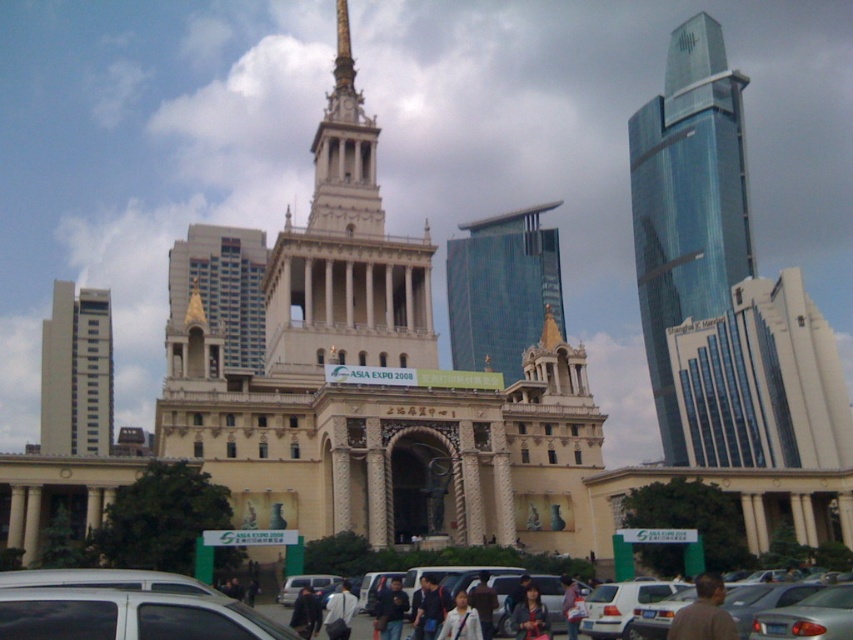
Can you confirm if shiny glass skyscraper at right is taller than light gray fabric jacket at center?

Correct, shiny glass skyscraper at right is much taller as light gray fabric jacket at center.

Measure the distance between shiny glass skyscraper at right and light gray fabric jacket at center.

A distance of 92.56 meters exists between shiny glass skyscraper at right and light gray fabric jacket at center.

Which is in front, point (648, 268) or point (323, 621)?

Point (323, 621) is in front.

Image resolution: width=853 pixels, height=640 pixels. Identify the location of shiny glass skyscraper at right. (688, 204).

Consider the image. Does white matte van at lower left appear on the left side of goldmaterial/texturespire at center?

In fact, white matte van at lower left is to the right of goldmaterial/texturespire at center.

Is the position of white matte van at lower left more distant than that of goldmaterial/texturespire at center?

That is False.

Locate an element on the screen. Image resolution: width=853 pixels, height=640 pixels. white matte van at lower left is located at coordinates (123, 609).

This screenshot has width=853, height=640. What are the coordinates of `white matte van at lower left` in the screenshot? It's located at (123, 609).

The height and width of the screenshot is (640, 853). What do you see at coordinates (363, 627) in the screenshot? I see `silver metallic car at lower center` at bounding box center [363, 627].

Which is behind, point (277, 618) or point (325, 576)?

Positioned behind is point (325, 576).

I want to click on silver metallic car at lower center, so click(x=363, y=627).